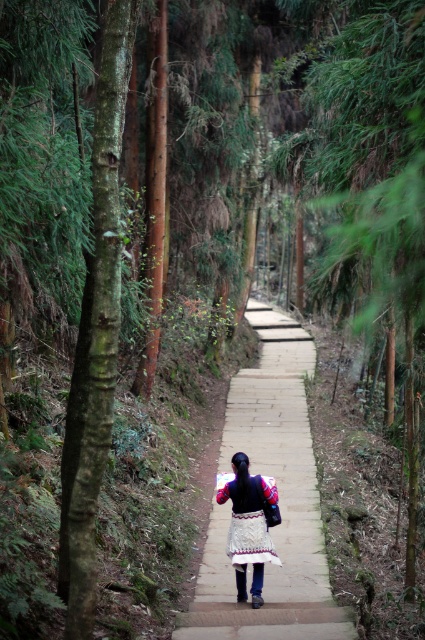
Consider the image. You are a photographer standing at the start of the forest path. You want to take a photo that includes both the brown rough bark tree at left and the white embroidered skirt at center. Which object will appear larger in the photo?

The brown rough bark tree at left will appear larger in the photo because it is taller than the white embroidered skirt at center.

You are a hiker carrying a backpack and want to walk along the smooth concrete path at center while avoiding stepping on the white embroidered skirt at center. Is the path wide enough for you to walk without touching the skirt?

The smooth concrete path at center might be wider than white embroidered skirt at center, so there is a possibility that the path is wide enough for the hiker to walk without touching the skirt. However, the exact width is uncertain based on the given information.